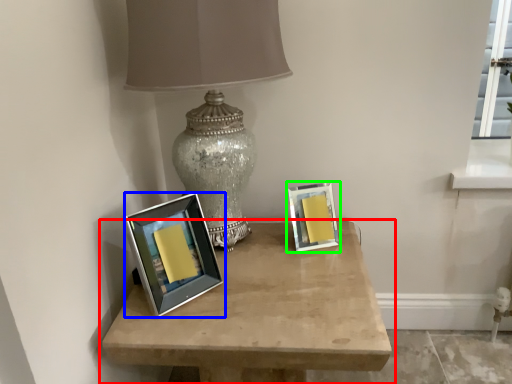
Question: Which is farther away from table (highlighted by a red box)? picture frame (highlighted by a blue box) or picture frame (highlighted by a green box)?

Choices:
 (A) picture frame
 (B) picture frame

Answer: (B)